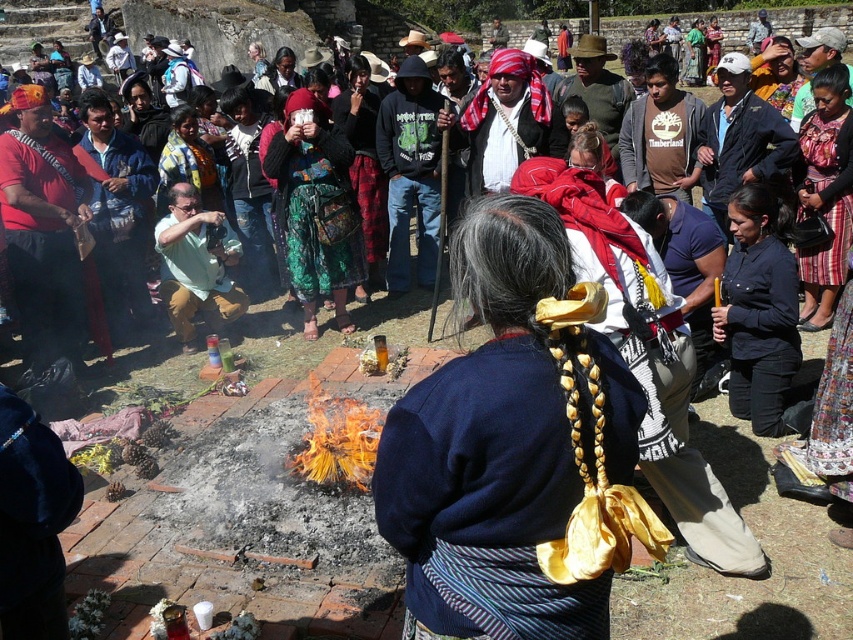
Image resolution: width=853 pixels, height=640 pixels. What do you see at coordinates (515, 449) in the screenshot?
I see `dark blue sweater at center` at bounding box center [515, 449].

Between point (466, 472) and point (299, 259), which one is positioned behind?

The point (299, 259) is more distant.

The image size is (853, 640). I want to click on dark blue sweater at center, so click(x=515, y=449).

Which of these two, multicolored woven skirt at center or green matte shirt at center, stands taller?

With more height is multicolored woven skirt at center.

Is multicolored woven skirt at center positioned behind green matte shirt at center?

No.

Locate an element on the screen. Image resolution: width=853 pixels, height=640 pixels. multicolored woven skirt at center is located at coordinates (316, 208).

Find the location of a particular element. The image size is (853, 640). multicolored woven skirt at center is located at coordinates (316, 208).

Can you confirm if dark blue sweater at center is wider than green matte shirt at center?

Indeed, dark blue sweater at center has a greater width compared to green matte shirt at center.

Can you confirm if dark blue sweater at center is positioned to the right of green matte shirt at center?

Correct, you'll find dark blue sweater at center to the right of green matte shirt at center.

Is point (601, 291) closer to viewer compared to point (165, 259)?

Yes.

Where is `dark blue sweater at center`? dark blue sweater at center is located at coordinates (515, 449).